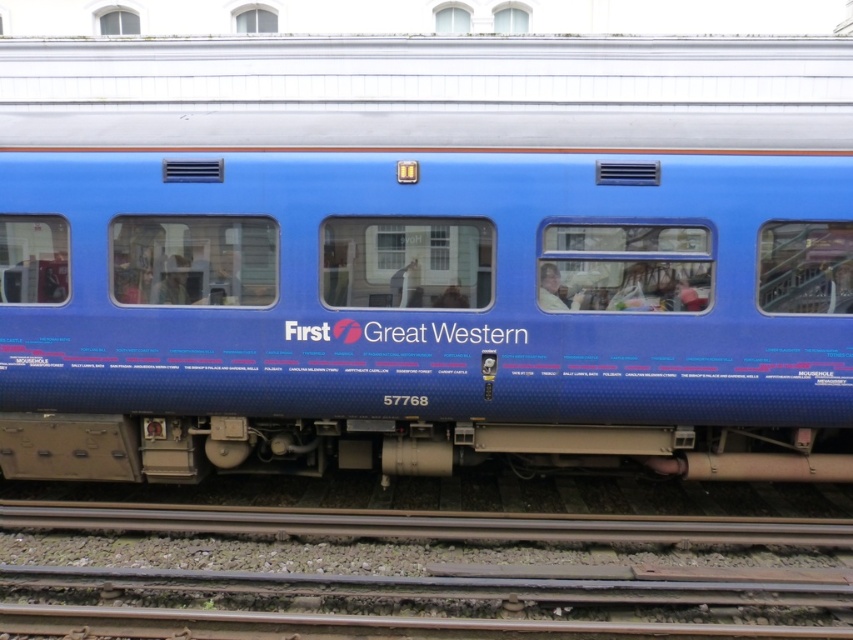
You are a photographer trying to capture the blue glossy train car at center and the smooth metal track at bottom in a single shot. Based on their sizes, which object should you focus on first to ensure both are clearly visible in the frame?

The blue glossy train car at center is larger in size than the smooth metal track at bottom, so you should focus on the blue glossy train car at center first to ensure both are clearly visible in the frame.